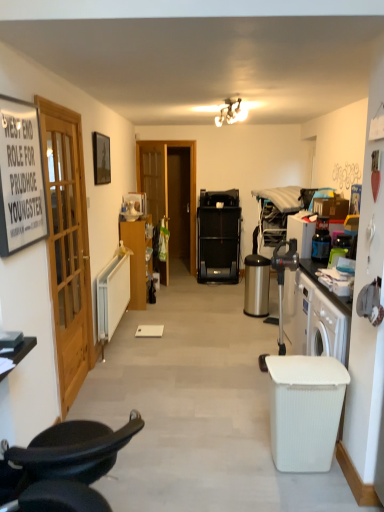
Locate an element on the screen. The width and height of the screenshot is (384, 512). matte wood cabinet at left is located at coordinates (136, 258).

What do you see at coordinates (136, 258) in the screenshot?
I see `matte wood cabinet at left` at bounding box center [136, 258].

You are a GUI agent. You are given a task and a screenshot of the screen. Output one action in this format:
    pyautogui.click(x=<x>, y=<y>)
    Task: Click on the black leather chair at lower left
    
    Given the screenshot: What is the action you would take?
    pyautogui.click(x=65, y=466)

This screenshot has width=384, height=512. What do you see at coordinates (68, 246) in the screenshot?
I see `wooden door at left` at bounding box center [68, 246].

The width and height of the screenshot is (384, 512). I want to click on black paper sign at left, arranged as the 1th picture frame when viewed from the front, so click(21, 177).

Can you confirm if matte white light fixture at upper center is smaller than wooden door at left?

Yes.

Measure the distance from matte white light fixture at upper center to wooden door at left.

A distance of 6.31 feet exists between matte white light fixture at upper center and wooden door at left.

Which is less distant, (221, 112) or (77, 311)?

Point (221, 112).

From the picture: From a real-world perspective, is matte white light fixture at upper center positioned above or below wooden door at left?

matte white light fixture at upper center is situated higher than wooden door at left in the real world.

How much distance is there between black leather chair at lower left and wooden door at left?

black leather chair at lower left is 4.27 feet from wooden door at left.

From the image's perspective, would you say black leather chair at lower left is positioned over wooden door at left?

No, from the image's perspective, black leather chair at lower left is not above wooden door at left.

Is black leather chair at lower left positioned with its back to wooden door at left?

No.

In terms of height, does satin silver trash can at lower right, marked as the first trash bin/can in a back-to-front arrangement, look taller or shorter compared to matte wood cabinet at left?

In the image, satin silver trash can at lower right, marked as the first trash bin/can in a back-to-front arrangement, appears to be shorter than matte wood cabinet at left.

From a real-world perspective, between satin silver trash can at lower right, marked as the first trash bin/can in a back-to-front arrangement, and matte wood cabinet at left, who is vertically lower?

In real-world perspective, satin silver trash can at lower right, marked as the first trash bin/can in a back-to-front arrangement, is lower.

Considering the positions of objects satin silver trash can at lower right, marked as the first trash bin/can in a back-to-front arrangement, and matte wood cabinet at left in the image provided, who is more to the left, satin silver trash can at lower right, marked as the first trash bin/can in a back-to-front arrangement, or matte wood cabinet at left?

matte wood cabinet at left is more to the left.

Which of these two, black leather chair at lower left or matte black picture frame at upper left, which is the first picture frame from back to front, is thinner?

matte black picture frame at upper left, which is the first picture frame from back to front.

Is black leather chair at lower left to the right of matte black picture frame at upper left, acting as the 2th picture frame starting from the front, from the viewer's perspective?

Correct, you'll find black leather chair at lower left to the right of matte black picture frame at upper left, acting as the 2th picture frame starting from the front.

Is the position of black leather chair at lower left less distant than that of matte black picture frame at upper left, which is the first picture frame from back to front?

Yes, black leather chair at lower left is closer to the camera.

Is black leather chair at lower left positioned beyond the bounds of matte black picture frame at upper left, acting as the 2th picture frame starting from the front?

Yes, black leather chair at lower left is not within matte black picture frame at upper left, acting as the 2th picture frame starting from the front.

From the image's perspective, which is below, matte black picture frame at upper left, acting as the 2th picture frame starting from the front, or black leather chair at lower left?

black leather chair at lower left.

Where is `the 2nd picture frame behind the black leather chair at lower left`? This screenshot has height=512, width=384. the 2nd picture frame behind the black leather chair at lower left is located at coordinates (101, 158).

Does matte black picture frame at upper left, acting as the 2th picture frame starting from the front, turn towards black leather chair at lower left?

No, matte black picture frame at upper left, acting as the 2th picture frame starting from the front, is not turned towards black leather chair at lower left.

Is matte black picture frame at upper left, acting as the 2th picture frame starting from the front, bigger or smaller than black leather chair at lower left?

In the image, matte black picture frame at upper left, acting as the 2th picture frame starting from the front, appears to be smaller than black leather chair at lower left.

Is black paper sign at left, arranged as the 1th picture frame when viewed from the front, oriented towards matte white light fixture at upper center?

No, black paper sign at left, arranged as the 1th picture frame when viewed from the front, is not oriented towards matte white light fixture at upper center.

What's the angular difference between black paper sign at left, the second picture frame in the back-to-front sequence, and matte white light fixture at upper center's facing directions?

78.4 degrees.

Are black paper sign at left, arranged as the 1th picture frame when viewed from the front, and matte white light fixture at upper center located far from each other?

black paper sign at left, arranged as the 1th picture frame when viewed from the front, is positioned a significant distance from matte white light fixture at upper center.

In the scene shown: Who is taller, black paper sign at left, arranged as the 1th picture frame when viewed from the front, or matte white light fixture at upper center?

black paper sign at left, arranged as the 1th picture frame when viewed from the front.

Between black paper sign at left, the second picture frame in the back-to-front sequence, and matte black picture frame at upper left, which is the first picture frame from back to front, which one is positioned behind?

matte black picture frame at upper left, which is the first picture frame from back to front, is behind.

Identify the location of picture frame below the matte black picture frame at upper left, which is the first picture frame from back to front (from the image's perspective). This screenshot has height=512, width=384. (21, 177).

Are black paper sign at left, arranged as the 1th picture frame when viewed from the front, and matte black picture frame at upper left, acting as the 2th picture frame starting from the front, making contact?

No, black paper sign at left, arranged as the 1th picture frame when viewed from the front, is not beside matte black picture frame at upper left, acting as the 2th picture frame starting from the front.

Is black paper sign at left, the second picture frame in the back-to-front sequence, wider or thinner than matte black picture frame at upper left, which is the first picture frame from back to front?

Considering their sizes, black paper sign at left, the second picture frame in the back-to-front sequence, looks slimmer than matte black picture frame at upper left, which is the first picture frame from back to front.

Where is `lamp that is behind the wooden door at left`? This screenshot has height=512, width=384. lamp that is behind the wooden door at left is located at coordinates (231, 113).

Locate an element on the screen. The image size is (384, 512). door positioned vertically above the black leather chair at lower left (from a real-world perspective) is located at coordinates (68, 246).

Estimate the real-world distances between objects in this image. Which object is further from black leather chair at lower left, satin silver trash can at lower right, which is counted as the first trash bin/can, starting from the top, or matte white light fixture at upper center?

The object further to black leather chair at lower left is satin silver trash can at lower right, which is counted as the first trash bin/can, starting from the top.

When comparing their distances from wooden door at left, does black paper sign at left, the second picture frame in the back-to-front sequence, or matte black picture frame at upper left, acting as the 2th picture frame starting from the front, seem closer?

black paper sign at left, the second picture frame in the back-to-front sequence, is positioned closer to the anchor wooden door at left.

In the scene shown: Looking at the image, which one is located further to satin silver trash can at lower right, positioned as the second trash bin/can in bottom-to-top order, matte wood cabinet at left or black leather chair at lower left?

black leather chair at lower left lies further to satin silver trash can at lower right, positioned as the second trash bin/can in bottom-to-top order, than the other object.

Looking at this image, considering their positions, is matte white light fixture at upper center positioned closer to black leather chair at lower left than matte wood cabinet at left?

Based on the image, matte white light fixture at upper center appears to be nearer to black leather chair at lower left.

Considering their positions, is wooden door at left positioned closer to matte wood cabinet at left than white ribbed plastic trash bin/can at lower right, which is counted as the first trash bin/can, starting from the bottom?

Based on the image, wooden door at left appears to be nearer to matte wood cabinet at left.

Estimate the real-world distances between objects in this image. Which object is further from matte wood cabinet at left, matte black picture frame at upper left, which is the first picture frame from back to front, or white ribbed plastic trash bin/can at lower right, which appears as the second trash bin/can when viewed from the top?

Among the two, white ribbed plastic trash bin/can at lower right, which appears as the second trash bin/can when viewed from the top, is located further to matte wood cabinet at left.

Based on their spatial positions, is white ribbed plastic trash bin/can at lower right, the second trash bin/can from the back, or black paper sign at left, arranged as the 1th picture frame when viewed from the front, closer to black leather chair at lower left?

Among the two, black paper sign at left, arranged as the 1th picture frame when viewed from the front, is located nearer to black leather chair at lower left.

Looking at the image, which one is located closer to black paper sign at left, the second picture frame in the back-to-front sequence, satin silver trash can at lower right, which is the second trash bin/can in front-to-back order, or wooden door at left?

wooden door at left lies closer to black paper sign at left, the second picture frame in the back-to-front sequence, than the other object.

This screenshot has height=512, width=384. I want to click on door located between black paper sign at left, the second picture frame in the back-to-front sequence, and satin silver trash can at lower right, which is the second trash bin/can in front-to-back order, in the depth direction, so click(68, 246).

This screenshot has height=512, width=384. I want to click on lamp between black paper sign at left, the second picture frame in the back-to-front sequence, and matte black picture frame at upper left, which is the first picture frame from back to front, in the front-back direction, so click(231, 113).

Locate an element on the screen. The image size is (384, 512). lamp positioned between white ribbed plastic trash bin/can at lower right, the second trash bin/can from the back, and matte wood cabinet at left from near to far is located at coordinates (231, 113).

At what (x,y) coordinates should I click in order to perform the action: click on door between matte white light fixture at upper center and black leather chair at lower left vertically. Please return your answer as a coordinate pair (x, y). This screenshot has height=512, width=384. Looking at the image, I should click on (68, 246).